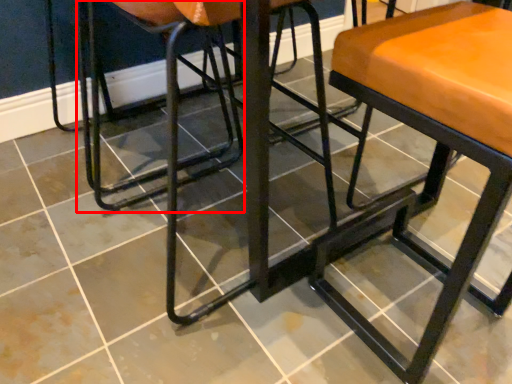
Question: From the image's perspective, considering the relative positions of swivel chair (annotated by the red box) and stool in the image provided, where is swivel chair (annotated by the red box) located with respect to the staircase?

Choices:
 (A) above
 (B) below

Answer: (A)